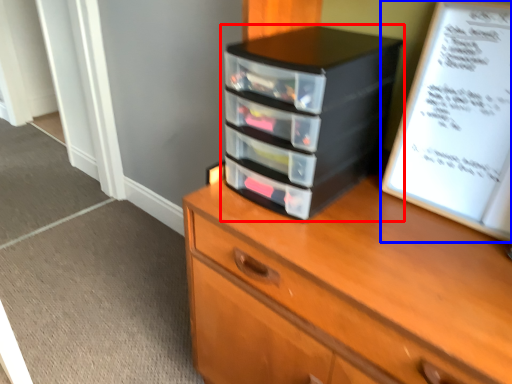
Question: Among these objects, which one is nearest to the camera, nightstand (highlighted by a red box) or paperback book (highlighted by a blue box)?

Choices:
 (A) nightstand
 (B) paperback book

Answer: (B)